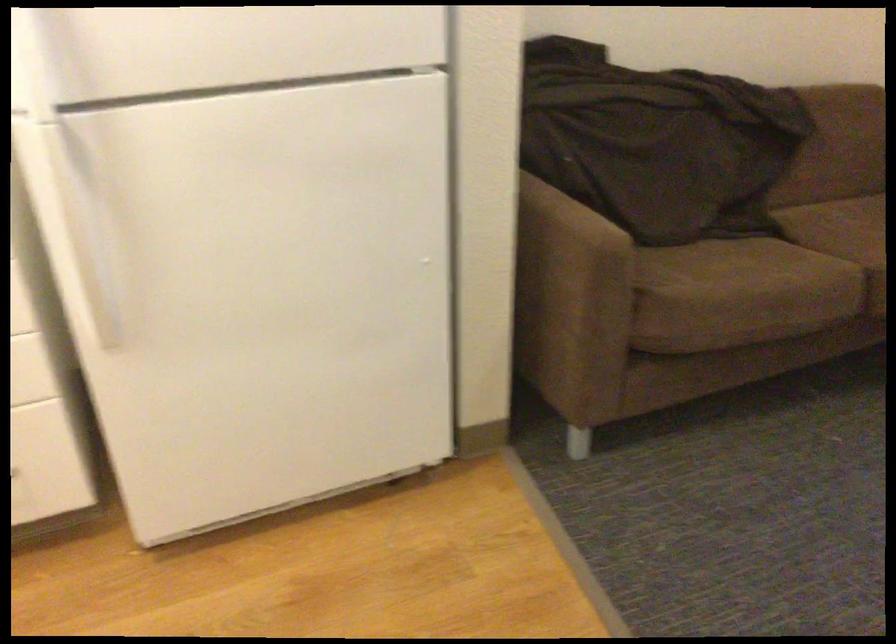
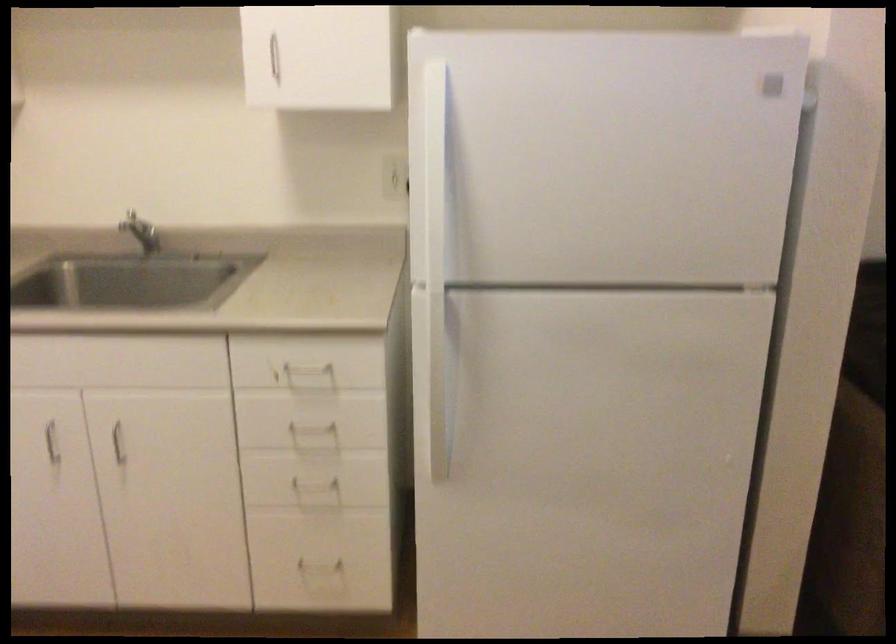
Question: What movement of the cameraman would produce the second image?

Choices:
 (A) Left
 (B) Right
 (C) Forward
 (D) Backward

Answer: (D)